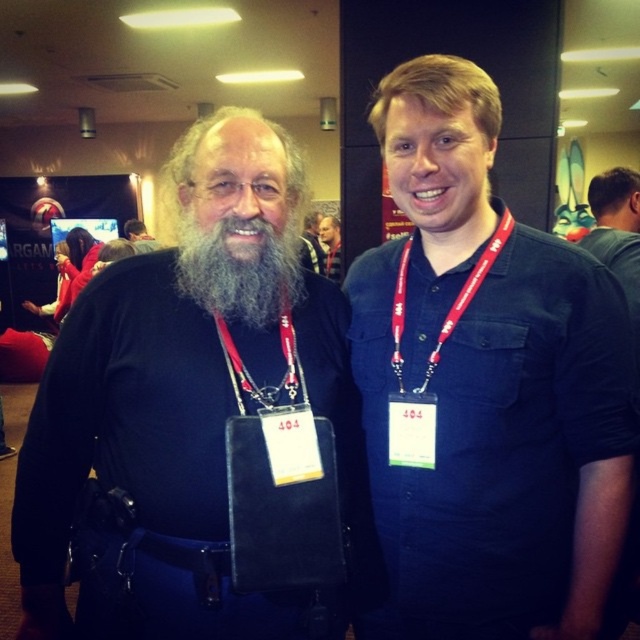
Can you confirm if blue denim shirt at center is wider than dark blue shirt at right?

No.

Can you confirm if blue denim shirt at center is bigger than dark blue shirt at right?

Incorrect, blue denim shirt at center is not larger than dark blue shirt at right.

Image resolution: width=640 pixels, height=640 pixels. I want to click on blue denim shirt at center, so click(x=486, y=396).

Is black matte jacket at left further to the viewer compared to gray beard at center?

No, black matte jacket at left is closer to the viewer.

Between black matte jacket at left and gray beard at center, which one appears on the right side from the viewer's perspective?

Positioned to the right is gray beard at center.

Identify the location of black matte jacket at left. The width and height of the screenshot is (640, 640). (202, 424).

Looking at this image, who is higher up, black matte jacket at left or blue denim shirt at center?

blue denim shirt at center

Is point (198, 304) positioned in front of point (595, 336)?

No, (198, 304) is behind (595, 336).

Who is more distant from viewer, (195, 611) or (490, 108)?

Positioned behind is point (490, 108).

Where is `black matte jacket at left`? Image resolution: width=640 pixels, height=640 pixels. black matte jacket at left is located at coordinates [202, 424].